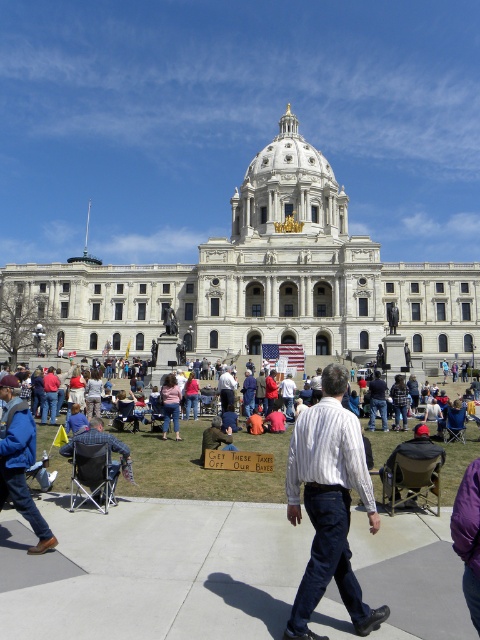
Question: Which of the following is the farthest from the observer?

Choices:
 (A) click(110, 464)
 (B) click(172, 376)
 (C) click(469, 538)
 (D) click(213, 438)

Answer: (B)

Question: Does blue denim jacket at lower left appear on the left side of plaid fabric chair at lower left?

Choices:
 (A) yes
 (B) no

Answer: (A)

Question: Which object is the farthest from the jeans at center?

Choices:
 (A) denim jacket at center
 (B) blue denim jacket at lower left

Answer: (B)

Question: Estimate the real-world distances between objects in this image. Which object is closer to the white striped shirt at center?

Choices:
 (A) plaid fabric chair at lower left
 (B) purple fabric at lower right
 (C) denim jacket at center

Answer: (B)

Question: Can you confirm if white striped shirt at center is positioned to the right of denim jacket at center?

Choices:
 (A) yes
 (B) no

Answer: (A)

Question: Does white striped shirt at center appear on the left side of plaid fabric chair at lower left?

Choices:
 (A) no
 (B) yes

Answer: (A)